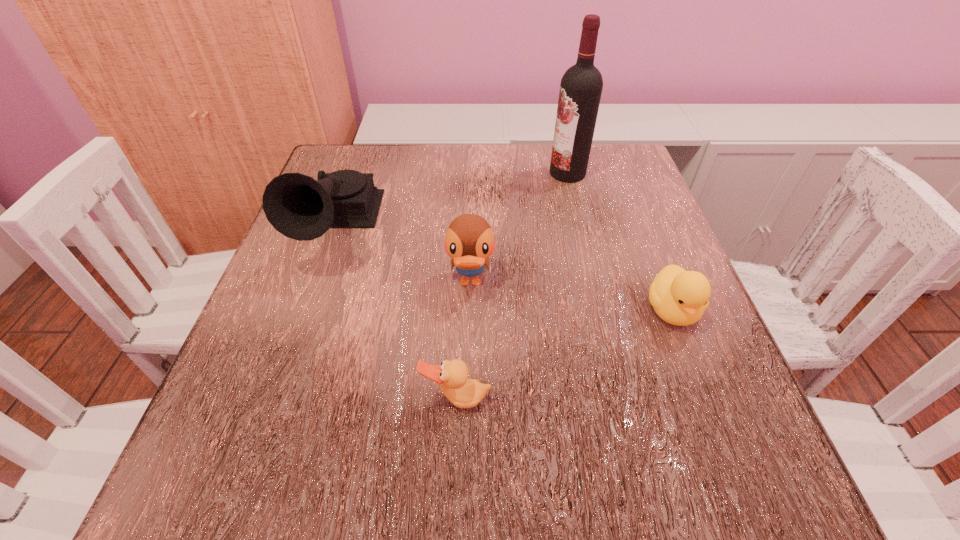
Find the location of a particular element. Image resolution: width=960 pixels, height=540 pixels. free space at the near right corner is located at coordinates (676, 501).

Where is `vacant point located between the shortest object and the second shortest duck`? This screenshot has height=540, width=960. vacant point located between the shortest object and the second shortest duck is located at coordinates (564, 355).

In order to click on vacant area that lies between the leftmost object and the shortest duck in this screenshot , I will do point(396,315).

Where is `free point between the rightmost object and the tallest duck`? This screenshot has width=960, height=540. free point between the rightmost object and the tallest duck is located at coordinates (571, 296).

In order to click on free point between the tallest duck and the shortest duck in this screenshot , I will do `click(464, 341)`.

Locate an element on the screen. This screenshot has height=540, width=960. free area in between the tallest object and the tallest duck is located at coordinates (519, 228).

What are the coordinates of `unoccupied area between the third tallest object and the farthest object` in the screenshot? It's located at (519, 228).

You are a GUI agent. You are given a task and a screenshot of the screen. Output one action in this format:
    pyautogui.click(x=<x>, y=<y>)
    Task: Click on the vacant space that's between the third shortest object and the second object from right to left
    
    Given the screenshot: What is the action you would take?
    pyautogui.click(x=519, y=228)

The image size is (960, 540). Identify the location of free area in between the second tallest object and the shortest object. (396, 315).

Identify the location of vacant space that's between the leftmost object and the tallest duck. (403, 257).